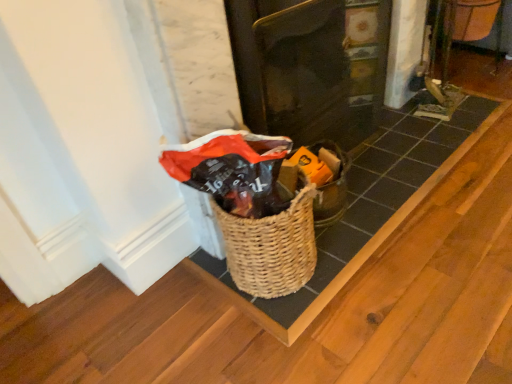
Question: Considering the positions of woven brown basket at center and woven wood basket at center in the image, is woven brown basket at center taller or shorter than woven wood basket at center?

Choices:
 (A) short
 (B) tall

Answer: (B)

Question: In terms of size, does woven brown basket at center appear bigger or smaller than woven wood basket at center?

Choices:
 (A) big
 (B) small

Answer: (A)

Question: Estimate the real-world distances between objects in this image. Which object is farther from the matte black door at center?

Choices:
 (A) woven brown basket at center
 (B) woven wood basket at center

Answer: (A)

Question: Based on their relative distances, which object is farther from the matte black door at center?

Choices:
 (A) woven wood basket at center
 (B) woven brown basket at center

Answer: (B)